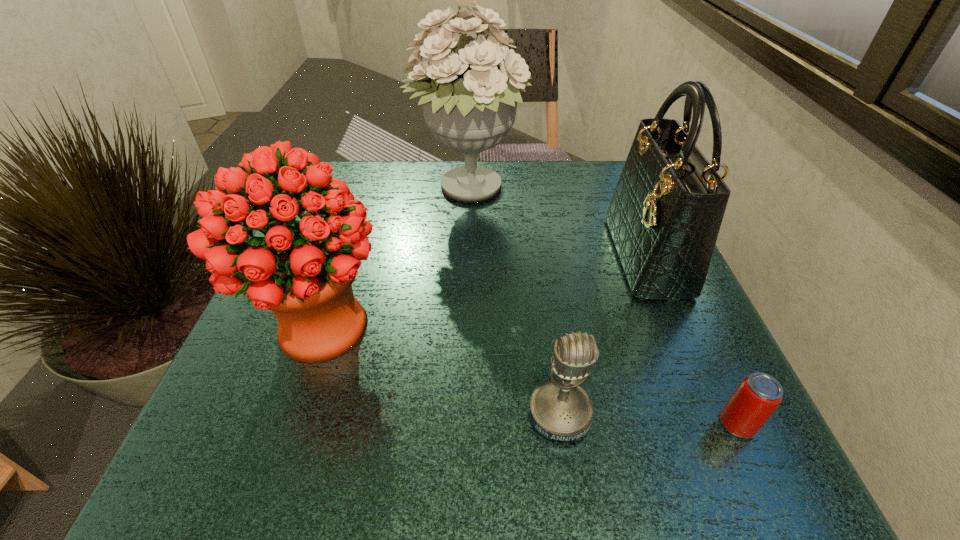
You are a GUI agent. You are given a task and a screenshot of the screen. Output one action in this format:
    pyautogui.click(x=<x>, y=<y>)
    Task: Click on the vacant region between the shortest object and the handbag
    This screenshot has height=540, width=960.
    Given the screenshot: What is the action you would take?
    pyautogui.click(x=692, y=340)

Find the location of a particular element. The image size is (960, 540). free space between the taller bouquet and the handbag is located at coordinates (558, 224).

Where is `unoccupied position between the nearer bouquet and the tallest object`? This screenshot has height=540, width=960. unoccupied position between the nearer bouquet and the tallest object is located at coordinates (396, 259).

Identify the location of vacant area between the taller bouquet and the microphone. (514, 302).

Locate an element on the screen. This screenshot has width=960, height=540. free space between the beer can and the taller bouquet is located at coordinates (603, 307).

Image resolution: width=960 pixels, height=540 pixels. Find the location of `free space that is in between the beer can and the taller bouquet`. free space that is in between the beer can and the taller bouquet is located at coordinates (603, 307).

You are a GUI agent. You are given a task and a screenshot of the screen. Output one action in this format:
    pyautogui.click(x=<x>, y=<y>)
    Task: Click on the free space between the beer can and the shorter bouquet
    This screenshot has width=960, height=540.
    Given the screenshot: What is the action you would take?
    pyautogui.click(x=529, y=376)

Identify the location of object that is the third closest to the second shortest object. (303, 271).

The height and width of the screenshot is (540, 960). I want to click on the second closest object to the nearer bouquet, so click(561, 410).

At what (x,y) coordinates should I click in order to perform the action: click on vacant region that satisfies the following two spatial constraints: 1. at the front of the handbag with visible charms; 2. on the right side of the beer can. Please return your answer as a coordinate pair (x, y). The image size is (960, 540). Looking at the image, I should click on (719, 424).